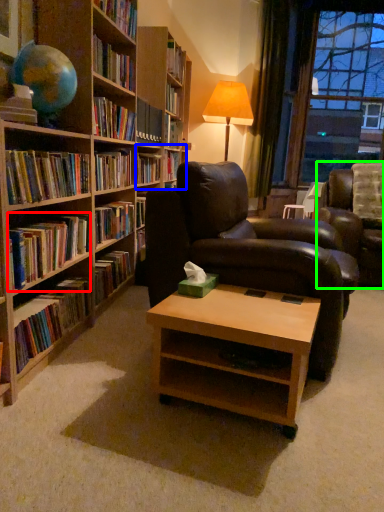
Question: Which is farther away from book (highlighted by a red box)? shelf (highlighted by a blue box) or studio couch (highlighted by a green box)?

Choices:
 (A) shelf
 (B) studio couch

Answer: (B)